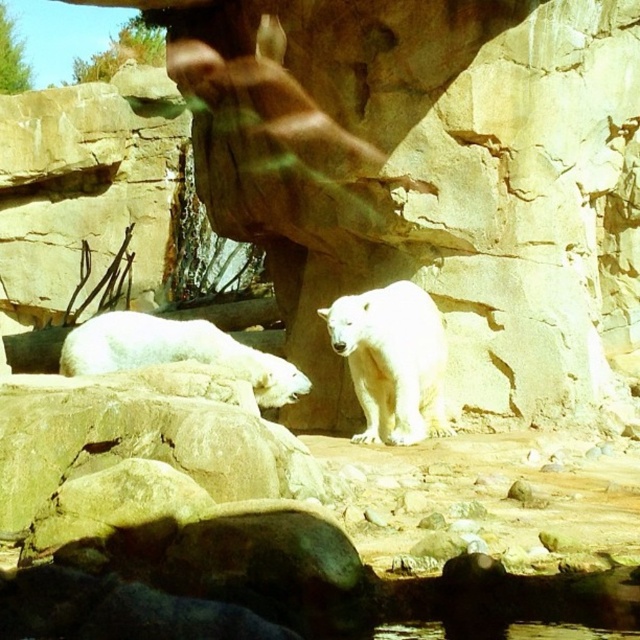
Question: Considering the relative positions of white fur bear at center and white fur bear at lower left in the image provided, where is white fur bear at center located with respect to white fur bear at lower left?

Choices:
 (A) left
 (B) right

Answer: (B)

Question: Can you confirm if white fur bear at center is bigger than white fur bear at lower left?

Choices:
 (A) yes
 (B) no

Answer: (B)

Question: Considering the relative positions of white fur bear at center and white fur bear at lower left in the image provided, where is white fur bear at center located with respect to white fur bear at lower left?

Choices:
 (A) left
 (B) right

Answer: (B)